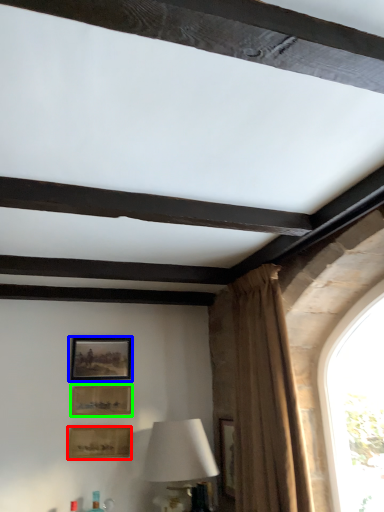
Question: Based on their relative distances, which object is nearer to picture frame (highlighted by a red box)? Choose from picture frame (highlighted by a blue box) and picture frame (highlighted by a green box).

Choices:
 (A) picture frame
 (B) picture frame

Answer: (B)